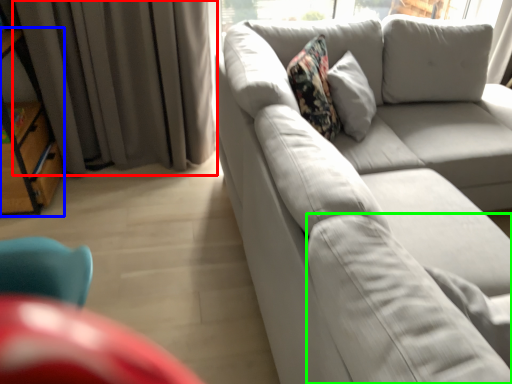
Question: Which object is the closest to the curtain (highlighted by a red box)? Choose among these: bookshelf (highlighted by a blue box) or pillow (highlighted by a green box).

Choices:
 (A) bookshelf
 (B) pillow

Answer: (A)